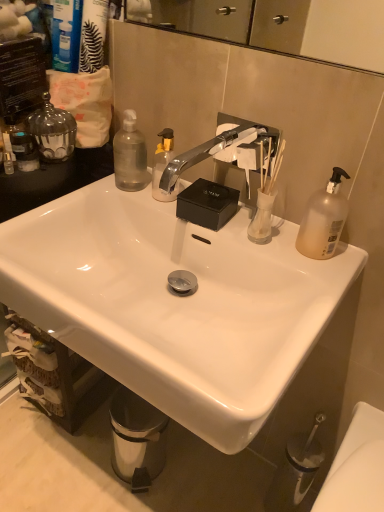
Question: Does chrome metallic faucet at center turn towards translucent plastic pump bottle at right, the 2th bottle in the left-to-right sequence?

Choices:
 (A) no
 (B) yes

Answer: (A)

Question: Does chrome metallic faucet at center lie in front of translucent plastic pump bottle at right, which is counted as the first bottle, starting from the front?

Choices:
 (A) no
 (B) yes

Answer: (B)

Question: Can you confirm if chrome metallic faucet at center is shorter than translucent plastic pump bottle at right, the 2th bottle in the left-to-right sequence?

Choices:
 (A) yes
 (B) no

Answer: (A)

Question: Would you consider chrome metallic faucet at center to be distant from translucent plastic pump bottle at right, the 2th bottle in the left-to-right sequence?

Choices:
 (A) yes
 (B) no

Answer: (B)

Question: Would you say translucent plastic pump bottle at right, which is counted as the first bottle, starting from the front, is part of chrome metallic faucet at center's contents?

Choices:
 (A) no
 (B) yes

Answer: (A)

Question: From a real-world perspective, is chrome metallic faucet at center positioned under translucent plastic pump bottle at right, which is counted as the first bottle, starting from the front, based on gravity?

Choices:
 (A) no
 (B) yes

Answer: (A)

Question: Is transparent plastic bottle at upper left, which is the first bottle from left to right, positioned with its back to metallic silver soap dispenser at left, the second toiletry from the left?

Choices:
 (A) no
 (B) yes

Answer: (A)

Question: From a real-world perspective, is transparent plastic bottle at upper left, the 2th bottle in the right-to-left sequence, under metallic silver soap dispenser at left, the 1th toiletry positioned from the right?

Choices:
 (A) no
 (B) yes

Answer: (B)

Question: Is transparent plastic bottle at upper left, which is the 1th bottle from back to front, in contact with metallic silver soap dispenser at left, the second toiletry from the left?

Choices:
 (A) no
 (B) yes

Answer: (A)

Question: Is transparent plastic bottle at upper left, the 2th bottle in the right-to-left sequence, not within metallic silver soap dispenser at left, the second toiletry from the left?

Choices:
 (A) no
 (B) yes

Answer: (B)

Question: Does transparent plastic bottle at upper left, which is the 2th bottle from front to back, have a smaller size compared to metallic silver soap dispenser at left, the 1th toiletry positioned from the right?

Choices:
 (A) no
 (B) yes

Answer: (A)

Question: Considering the relative sizes of transparent plastic bottle at upper left, the 2th bottle in the right-to-left sequence, and metallic silver soap dispenser at left, the second toiletry from the left, in the image provided, is transparent plastic bottle at upper left, the 2th bottle in the right-to-left sequence, bigger than metallic silver soap dispenser at left, the second toiletry from the left,?

Choices:
 (A) yes
 (B) no

Answer: (A)

Question: Is translucent plastic soap dispenser at left, the first toiletry when ordered from left to right, aimed at transparent plastic bottle at upper left, the 2th bottle in the right-to-left sequence?

Choices:
 (A) yes
 (B) no

Answer: (B)